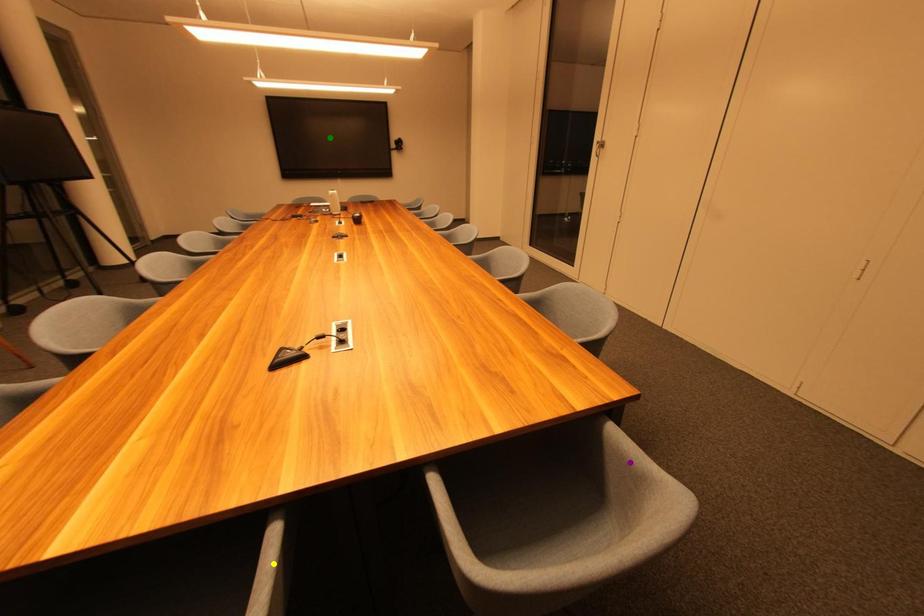
Order these from farthest to nearest:
1. yellow point
2. green point
3. purple point

green point
purple point
yellow point